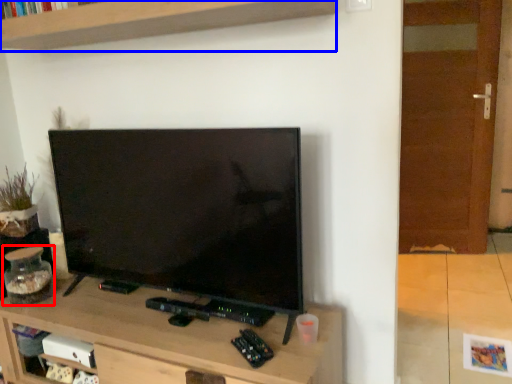
Question: Among these objects, which one is farthest to the camera, glass jar (highlighted by a red box) or shelf (highlighted by a blue box)?

Choices:
 (A) glass jar
 (B) shelf

Answer: (A)